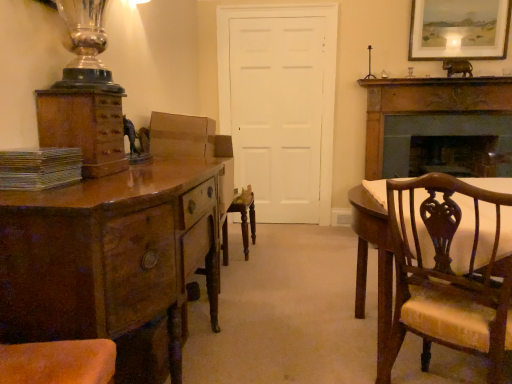
What are the coordinates of `free space to the right of metallic silver book at left` in the screenshot? It's located at (95, 187).